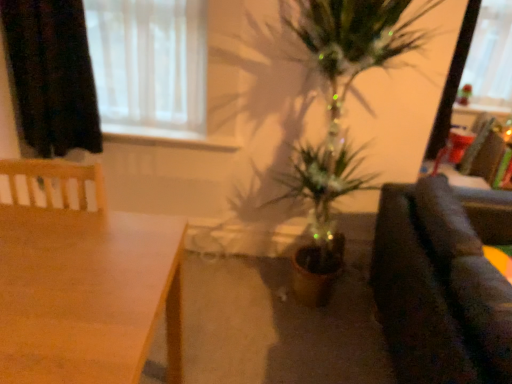
Question: Is white sheer curtain at upper left outside wooden table at lower left?

Choices:
 (A) yes
 (B) no

Answer: (A)

Question: From a real-world perspective, is white sheer curtain at upper left below wooden table at lower left?

Choices:
 (A) yes
 (B) no

Answer: (B)

Question: Is white sheer curtain at upper left looking in the opposite direction of wooden table at lower left?

Choices:
 (A) no
 (B) yes

Answer: (A)

Question: From the image's perspective, does white sheer curtain at upper left appear lower than wooden table at lower left?

Choices:
 (A) yes
 (B) no

Answer: (B)

Question: Considering the relative sizes of white sheer curtain at upper left and wooden table at lower left in the image provided, is white sheer curtain at upper left wider than wooden table at lower left?

Choices:
 (A) no
 (B) yes

Answer: (A)

Question: Can you confirm if white sheer curtain at upper left is bigger than wooden table at lower left?

Choices:
 (A) no
 (B) yes

Answer: (A)

Question: Is black fabric curtain at upper left shorter than wooden table at lower left?

Choices:
 (A) yes
 (B) no

Answer: (A)

Question: Can you confirm if black fabric curtain at upper left is bigger than wooden table at lower left?

Choices:
 (A) yes
 (B) no

Answer: (B)

Question: Is black fabric curtain at upper left thinner than wooden table at lower left?

Choices:
 (A) no
 (B) yes

Answer: (B)

Question: Is black fabric curtain at upper left positioned with its back to wooden table at lower left?

Choices:
 (A) yes
 (B) no

Answer: (B)

Question: Is black fabric curtain at upper left further to the viewer compared to wooden table at lower left?

Choices:
 (A) no
 (B) yes

Answer: (B)

Question: From the image's perspective, is black fabric curtain at upper left above wooden table at lower left?

Choices:
 (A) no
 (B) yes

Answer: (B)

Question: Is white sheer curtain at upper left to the right of dark fabric couch at right from the viewer's perspective?

Choices:
 (A) yes
 (B) no

Answer: (B)